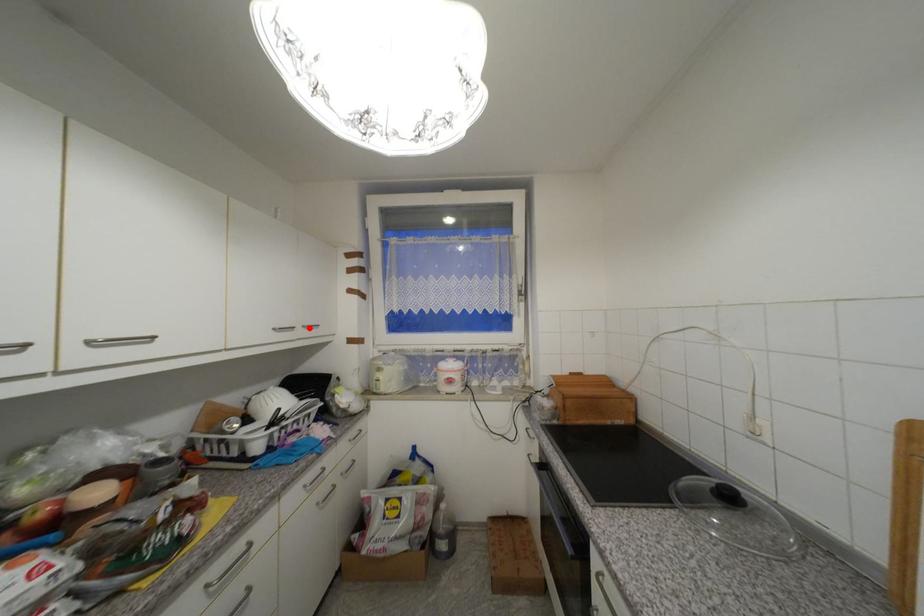
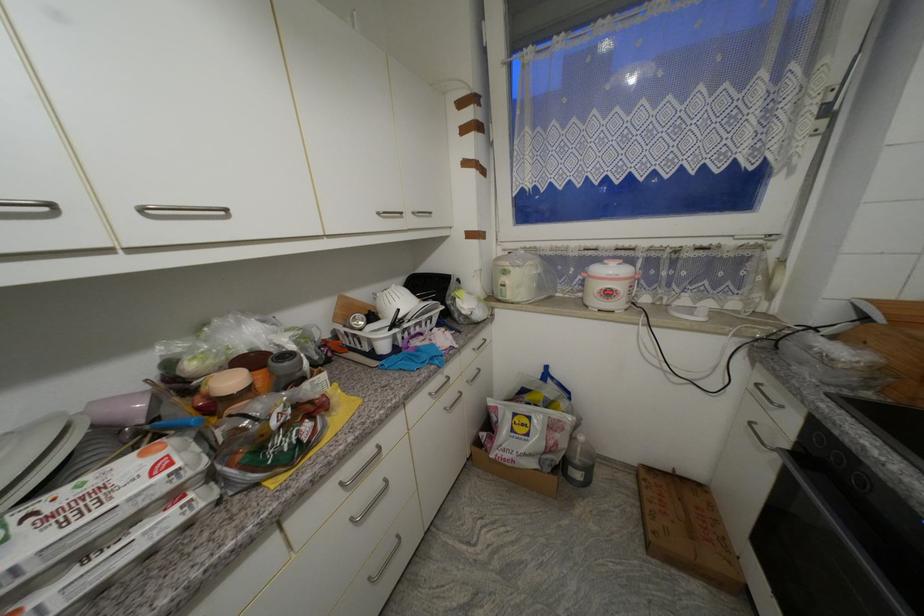
Question: I am providing you with two images of the same scene from different viewpoints. Given a red point in image1, look at the same physical point in image2. Is it:

Choices:
 (A) Closer to the viewpoint
 (B) Farther from the viewpoint

Answer: (A)